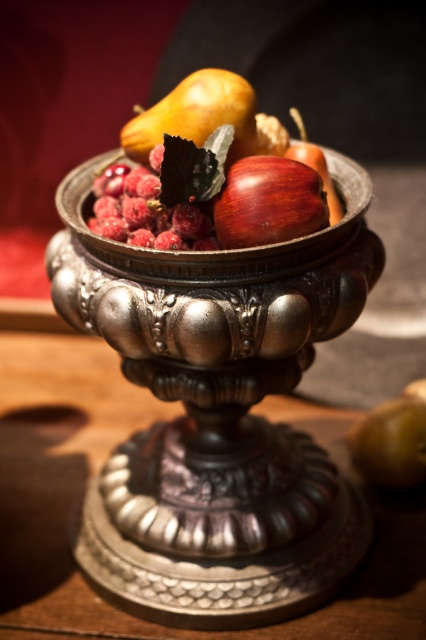
You are arranging fruits on a table and have the metallic silver bowl at center and the shiny brown pear at center. If you want to place the pear inside the bowl, will it fit based on their sizes?

The metallic silver bowl at center has a larger size compared to shiny brown pear at center, so the pear will fit inside the bowl.

Looking at this image, you are arranging fruits on a table and want to place a shiny brown apple at center and a shiny green apple at lower right. Based on their sizes, which apple should you place first to ensure they fit properly?

The shiny brown apple at center occupies less space than the shiny green apple at lower right, so you should place the shiny green apple at lower right first to ensure proper arrangement.